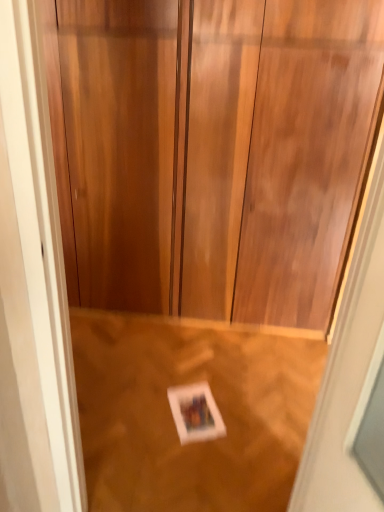
Identify the location of white paper at center. (195, 413).

Image resolution: width=384 pixels, height=512 pixels. Describe the element at coordinates (305, 155) in the screenshot. I see `wooden door at center` at that location.

Image resolution: width=384 pixels, height=512 pixels. In order to click on wooden door at center in this screenshot , I will do [305, 155].

Measure the distance between point (165, 459) and camera.

Point (165, 459) is 5.59 feet away from camera.

Based on the photo, what is the approximate width of wooden floor at lower center?

wooden floor at lower center is 4.13 feet wide.

Find the location of a particular element. white paper at center is located at coordinates [x=195, y=413].

From the picture: Is wooden door at center further to the viewer compared to wooden floor at lower center?

No, wooden door at center is closer to the viewer.

Is wooden door at center far from wooden floor at lower center?

Actually, wooden door at center and wooden floor at lower center are a little close together.

How different are the orientations of wooden door at center and wooden floor at lower center in degrees?

The angular difference between wooden door at center and wooden floor at lower center is 95 degrees.

Find the location of a particular element. The image size is (384, 512). door on the right of white paper at center is located at coordinates (305, 155).

Is point (188, 430) closer to camera compared to point (262, 74)?

That is True.

Would you say white paper at center is to the left or to the right of wooden door at center in the picture?

Based on their positions, white paper at center is located to the left of wooden door at center.

Looking at this image, is white paper at center oriented towards wooden door at center?

No, white paper at center does not turn towards wooden door at center.

From the image's perspective, which one is positioned higher, wooden door at center or white paper at center?

wooden door at center appears higher in the image.

Between wooden door at center and white paper at center, which one appears on the left side from the viewer's perspective?

Positioned to the left is white paper at center.

Does wooden door at center have a larger size compared to white paper at center?

Indeed, wooden door at center has a larger size compared to white paper at center.

Considering the relative sizes of wooden door at center and white paper at center in the image provided, is wooden door at center thinner than white paper at center?

Correct, the width of wooden door at center is less than that of white paper at center.

Considering the sizes of objects wooden floor at lower center and white paper at center in the image provided, who is bigger, wooden floor at lower center or white paper at center?

wooden floor at lower center.

Which of these two, wooden floor at lower center or white paper at center, stands shorter?

With less height is white paper at center.

Does wooden floor at lower center contain white paper at center?

Indeed, white paper at center is located within wooden floor at lower center.

Is white paper at center at the back of wooden floor at lower center?

Correct, wooden floor at lower center is looking away from white paper at center.

Where is `plywood lying below the wooden door at center (from the image's perspective)`? plywood lying below the wooden door at center (from the image's perspective) is located at coordinates (172, 418).

Does point (252, 464) lie behind point (351, 148)?

No, it is in front of (351, 148).

Is wooden floor at lower center positioned with its back to wooden door at center?

No, wooden floor at lower center is not facing away from wooden door at center.

Based on the photo, from a real-world perspective, does wooden floor at lower center stand above wooden door at center?

No.

Locate an element on the screen. postcard below the wooden floor at lower center (from a real-world perspective) is located at coordinates (195, 413).

Would you consider white paper at center to be distant from wooden floor at lower center?

Actually, white paper at center and wooden floor at lower center are a little close together.

Can you confirm if white paper at center is smaller than wooden floor at lower center?

Indeed, white paper at center has a smaller size compared to wooden floor at lower center.

Based on the photo, does white paper at center appear on the left side of wooden floor at lower center?

No, white paper at center is not to the left of wooden floor at lower center.

Where is `door that is above the wooden floor at lower center (from a real-world perspective)`? This screenshot has width=384, height=512. door that is above the wooden floor at lower center (from a real-world perspective) is located at coordinates (305, 155).

Find the location of a particular element. This screenshot has height=512, width=384. postcard below the wooden door at center (from a real-world perspective) is located at coordinates (195, 413).

Estimate the real-world distances between objects in this image. Which object is further from wooden floor at lower center, white paper at center or wooden door at center?

wooden door at center.

Based on the photo, based on their spatial positions, is wooden floor at lower center or wooden door at center closer to white paper at center?

The object closer to white paper at center is wooden floor at lower center.

Estimate the real-world distances between objects in this image. Which object is closer to wooden door at center, white paper at center or wooden floor at lower center?

wooden floor at lower center is positioned closer to the anchor wooden door at center.

Considering their positions, is wooden floor at lower center positioned closer to wooden door at center than white paper at center?

The object closer to wooden door at center is wooden floor at lower center.

Looking at the image, which one is located closer to wooden floor at lower center, wooden door at center or white paper at center?

Based on the image, white paper at center appears to be nearer to wooden floor at lower center.

Looking at the image, which one is located closer to white paper at center, wooden door at center or wooden floor at lower center?

Based on the image, wooden floor at lower center appears to be nearer to white paper at center.

I want to click on plywood between wooden door at center and white paper at center in the front-back direction, so click(x=172, y=418).